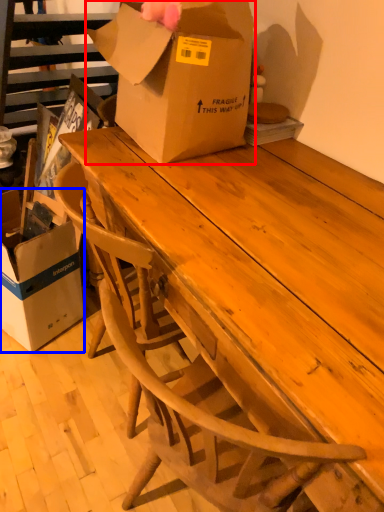
Question: Which point is further to the camera, box (highlighted by a red box) or box (highlighted by a blue box)?

Choices:
 (A) box
 (B) box

Answer: (B)